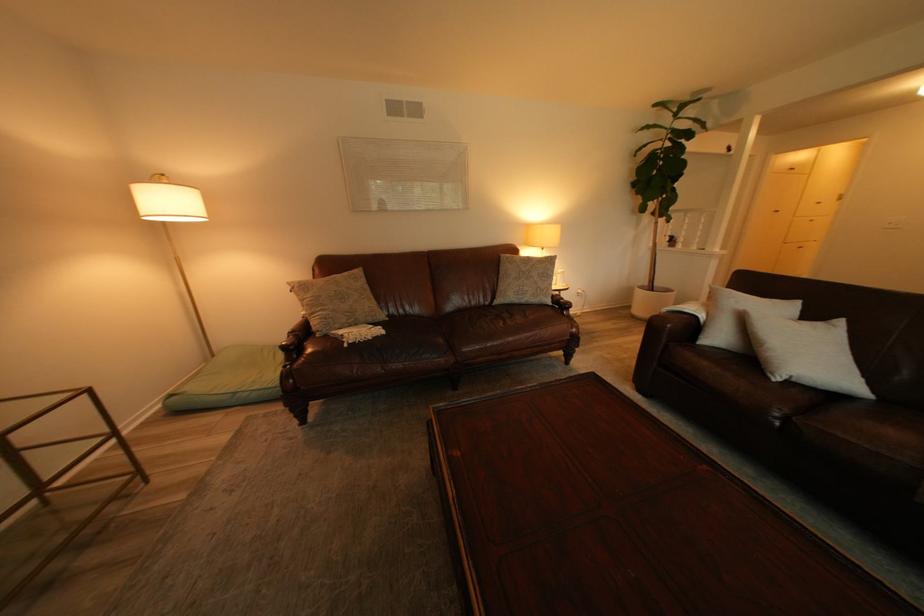
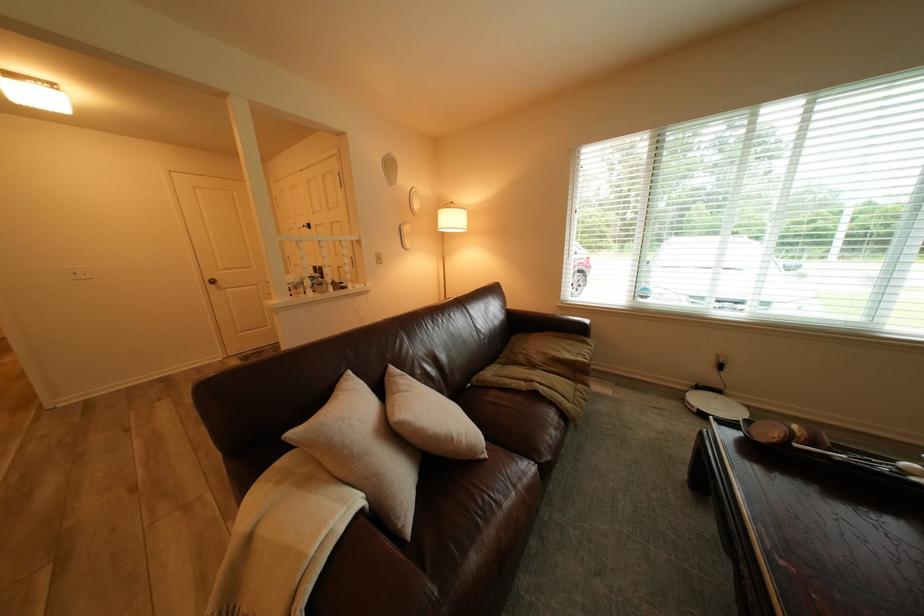
Locate, in the second image, the point that corresponds to [715,317] in the first image.

(372, 500)